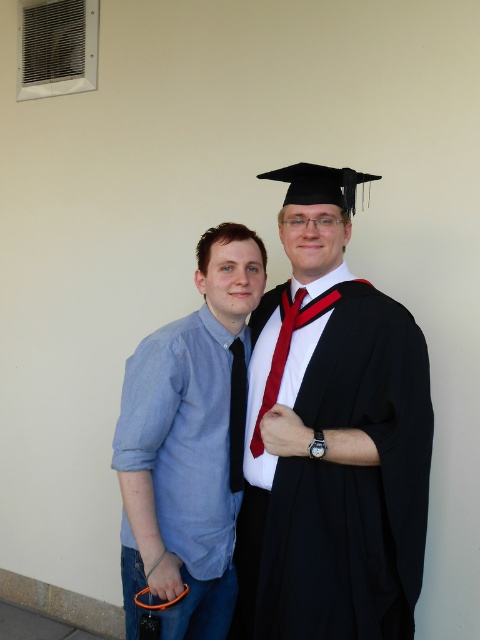
Question: Does matte black graduation gown at center lie behind shiny silk tie at center?

Choices:
 (A) no
 (B) yes

Answer: (A)

Question: Considering the real-world distances, which object is closest to the shiny silk tie at center?

Choices:
 (A) blue cotton shirt at left
 (B) matte black graduation gown at center

Answer: (B)

Question: Can you confirm if matte black graduation gown at center is wider than blue cotton shirt at left?

Choices:
 (A) no
 (B) yes

Answer: (B)

Question: Which point appears closest to the camera in this image?

Choices:
 (A) tap(315, 428)
 (B) tap(259, 442)
 (C) tap(216, 616)

Answer: (A)

Question: Can you confirm if blue cotton shirt at left is positioned to the left of shiny silk tie at center?

Choices:
 (A) no
 (B) yes

Answer: (B)

Question: Which object is the farthest from the matte black graduation gown at center?

Choices:
 (A) blue cotton shirt at left
 (B) shiny silk tie at center

Answer: (B)